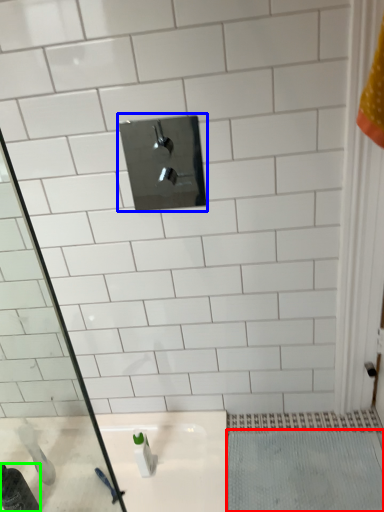
Question: Which object is positioned farthest from bath mat (highlighted by a red box)? Select from tap (highlighted by a blue box) and bottle (highlighted by a green box).

Choices:
 (A) tap
 (B) bottle

Answer: (A)